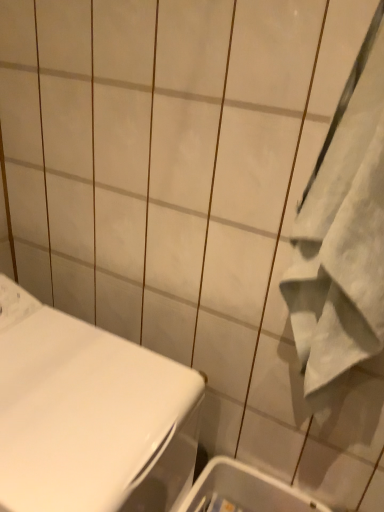
Locate an element on the screen. white glossy toilet at lower left is located at coordinates (87, 414).

What do you see at coordinates (87, 414) in the screenshot? I see `white glossy toilet at lower left` at bounding box center [87, 414].

Where is `white glossy toilet at lower left`? white glossy toilet at lower left is located at coordinates (87, 414).